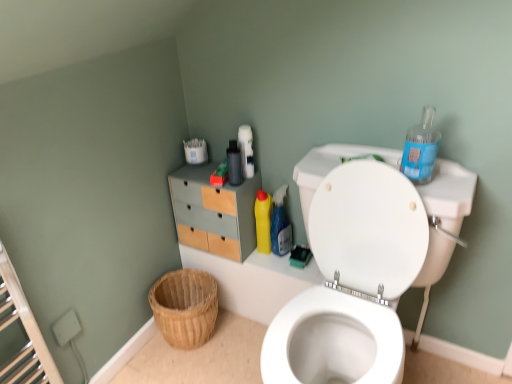
Question: Which is correct: matte wood/file cabinet at upper left is inside yellow plastic bottle at upper right, arranged as the second cleaning product when viewed from the left, or outside of it?

Choices:
 (A) inside
 (B) outside

Answer: (B)

Question: Considering the positions of matte wood/file cabinet at upper left and yellow plastic bottle at upper right, arranged as the second cleaning product when viewed from the left, in the image, is matte wood/file cabinet at upper left wider or thinner than yellow plastic bottle at upper right, arranged as the second cleaning product when viewed from the left,?

Choices:
 (A) thin
 (B) wide

Answer: (B)

Question: Estimate the real-world distances between objects in this image. Which object is farther from the matte black bottle at upper center?

Choices:
 (A) white glossy toilet at upper right
 (B) yellow plastic bottle at upper right, the second cleaning product viewed from the right
 (C) yellow plastic bottle at center, which is counted as the first cleaning product, starting from the left
 (D) blue plastic bottle at upper right, arranged as the first cleaning product when viewed from the right
 (E) woven wood basket at lower left

Answer: (D)

Question: Which of these objects is positioned farthest from the yellow plastic bottle at upper right, which is counted as the 2th cleaning product, starting from the back?

Choices:
 (A) yellow plastic bottle at center, which is counted as the first cleaning product, starting from the left
 (B) blue plastic bottle at upper right, placed as the 3th cleaning product when sorted from left to right
 (C) matte black bottle at upper center
 (D) woven wood basket at lower left
 (E) matte wood/file cabinet at upper left

Answer: (B)